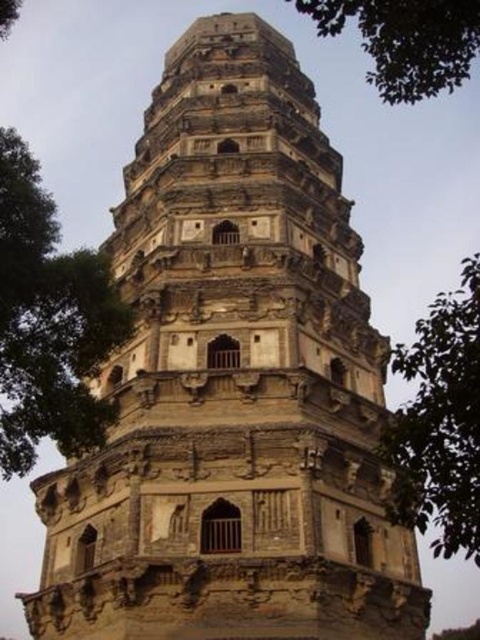
Question: Does green leafy tree at left have a greater width compared to green leafy tree at right?

Choices:
 (A) yes
 (B) no

Answer: (B)

Question: Which point is closer to the camera?

Choices:
 (A) (13, 378)
 (B) (437, 518)

Answer: (A)

Question: Does green leafy tree at left appear on the right side of green leafy tree at upper center?

Choices:
 (A) yes
 (B) no

Answer: (B)

Question: Which object is farther from the camera taking this photo?

Choices:
 (A) green leafy tree at left
 (B) green leafy tree at upper center
 (C) green leafy tree at right

Answer: (B)

Question: Among these objects, which one is farthest from the camera?

Choices:
 (A) green leafy tree at right
 (B) green leafy tree at upper center
 (C) green leafy tree at left

Answer: (B)

Question: Does green leafy tree at right appear under green leafy tree at upper center?

Choices:
 (A) no
 (B) yes

Answer: (B)